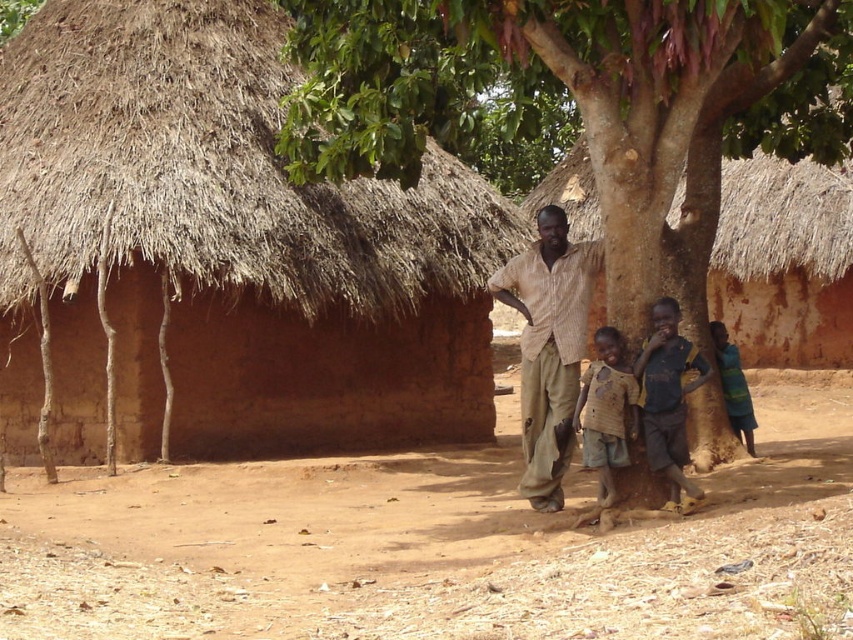
You are a visitor to this rural area and want to know which object is narrower between the green leafy tree at center and the light brown striped shirt at center. Can you tell me?

The green leafy tree at center is thinner than the light brown striped shirt at center, so the green leafy tree at center is narrower.

You are standing in the rural scene and want to take a photo of both the brown mud hut at center and the brown textured shirt at center. Which object should you focus on first to ensure it appears sharp in the photo?

You should focus on the brown mud hut at center first because it is closer to you than the brown textured shirt at center, ensuring it will be in focus before adjusting for the shirt.

You are a visitor approaching the group of people under the large tree. You see the brown mud hut at center and the brown textured shirt at center. Which object is closer to your left side as you face the scene?

The brown mud hut at center is to the left of brown textured shirt at center, so as you face the scene, the brown mud hut at center will be closer to your left side.